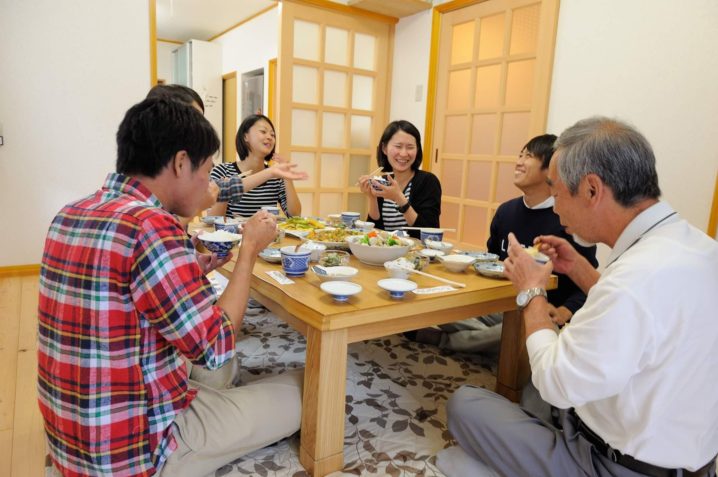
Locate an element on the screen. This screenshot has height=477, width=718. natural wood baseboard is located at coordinates (11, 271).